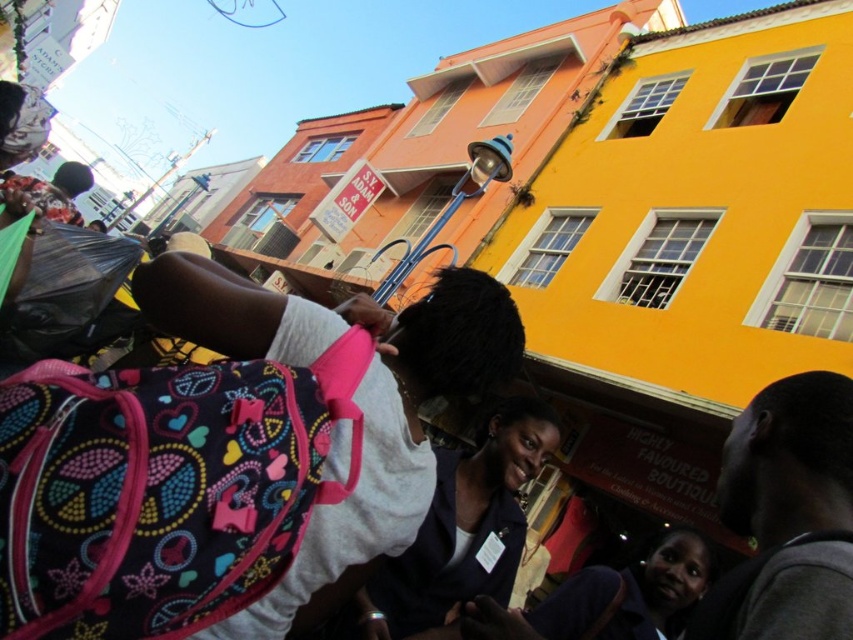
Question: Which object is farther from the camera taking this photo?

Choices:
 (A) dark gray sweater at lower right
 (B) dark blue fabric jacket at center

Answer: (B)

Question: Is dark gray sweater at lower right below dark blue fabric jacket at center?

Choices:
 (A) no
 (B) yes

Answer: (A)

Question: Is dark gray sweater at lower right behind dark blue fabric jacket at center?

Choices:
 (A) yes
 (B) no

Answer: (B)

Question: Estimate the real-world distances between objects in this image. Which object is farther from the dark blue fabric jacket at lower center?

Choices:
 (A) dark gray sweater at lower right
 (B) dark blue fabric jacket at center

Answer: (A)

Question: Is dark gray sweater at lower right above dark blue fabric jacket at lower center?

Choices:
 (A) yes
 (B) no

Answer: (A)

Question: Among these objects, which one is nearest to the camera?

Choices:
 (A) dark blue fabric jacket at lower center
 (B) dark gray sweater at lower right

Answer: (B)